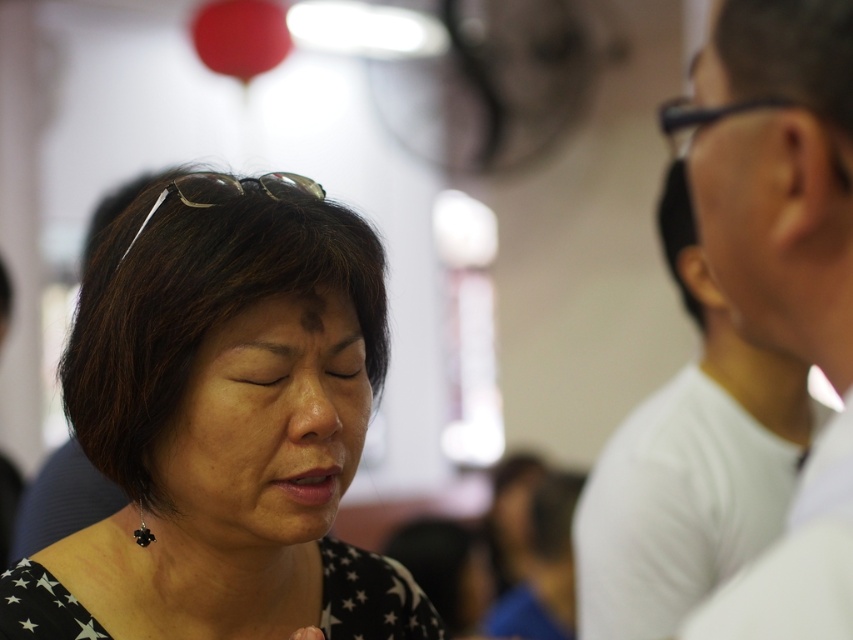
You are at a party and see two faces in the image. The smooth skin face at center and the matte white face at right. Which one is positioned lower in the image?

The smooth skin face at center is positioned lower than the matte white face at right.